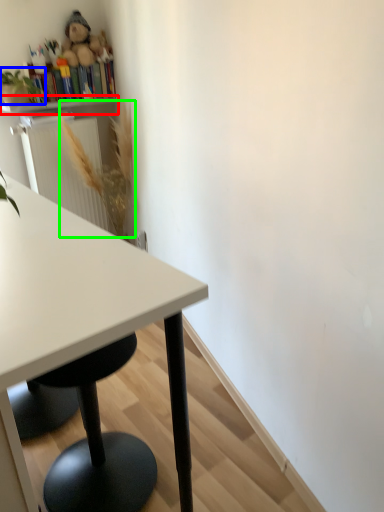
Question: Which object is positioned farthest from shelf (highlighted by a red box)? Select from plant (highlighted by a blue box) and flower (highlighted by a green box).

Choices:
 (A) plant
 (B) flower

Answer: (B)